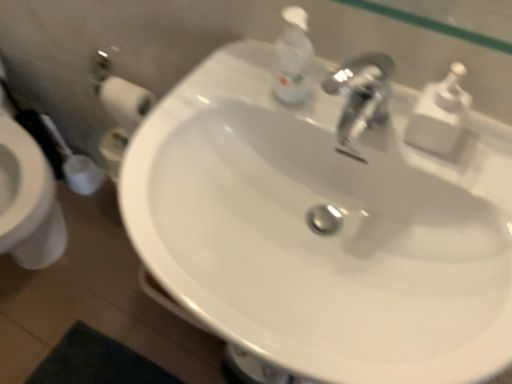
Question: Considering the positions of white glossy sink at center and white plastic soap dispenser at upper right, the second soap dispenser in the left-to-right sequence, in the image, is white glossy sink at center taller or shorter than white plastic soap dispenser at upper right, the second soap dispenser in the left-to-right sequence,?

Choices:
 (A) tall
 (B) short

Answer: (A)

Question: From a real-world perspective, is white glossy sink at center physically located above or below white plastic soap dispenser at upper right, the second soap dispenser in the left-to-right sequence?

Choices:
 (A) below
 (B) above

Answer: (A)

Question: Based on their relative distances, which object is nearer to the white plastic soap dispenser at upper right, which is the 1th soap dispenser in right-to-left order?

Choices:
 (A) white glossy sink at center
 (B) white plastic soap dispenser at upper center, the first soap dispenser from the left

Answer: (B)

Question: Which is farther from the white glossy sink at center?

Choices:
 (A) white plastic soap dispenser at upper center, the 2th soap dispenser in the right-to-left sequence
 (B) white plastic soap dispenser at upper right, which is the 1th soap dispenser in right-to-left order

Answer: (B)